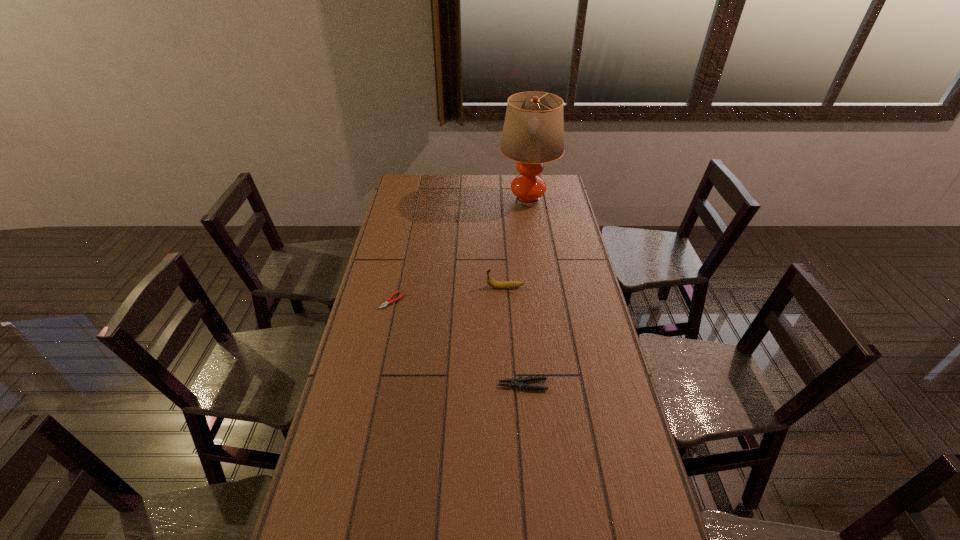
At what (x,y) coordinates should I click in order to perform the action: click on lamp. Please return your answer as a coordinate pair (x, y). Image resolution: width=960 pixels, height=540 pixels. Looking at the image, I should click on (533, 133).

Identify the location of the tallest object. (533, 133).

Identify the location of the third nearest object. This screenshot has width=960, height=540. (495, 284).

Image resolution: width=960 pixels, height=540 pixels. Identify the location of banana. (495, 284).

Image resolution: width=960 pixels, height=540 pixels. Identify the location of the nearest object. click(519, 382).

Locate an element on the screen. Image resolution: width=960 pixels, height=540 pixels. the second shortest object is located at coordinates point(519,382).

The width and height of the screenshot is (960, 540). I want to click on the leftmost object, so click(x=388, y=301).

Locate an element on the screen. the farther pliers is located at coordinates (388, 301).

Find the location of a particular element. The image size is (960, 540). vacant space located 0.290m on the left of the lamp is located at coordinates (440, 201).

Find the location of `blank space located at the stem of the third nearest object`. blank space located at the stem of the third nearest object is located at coordinates (468, 287).